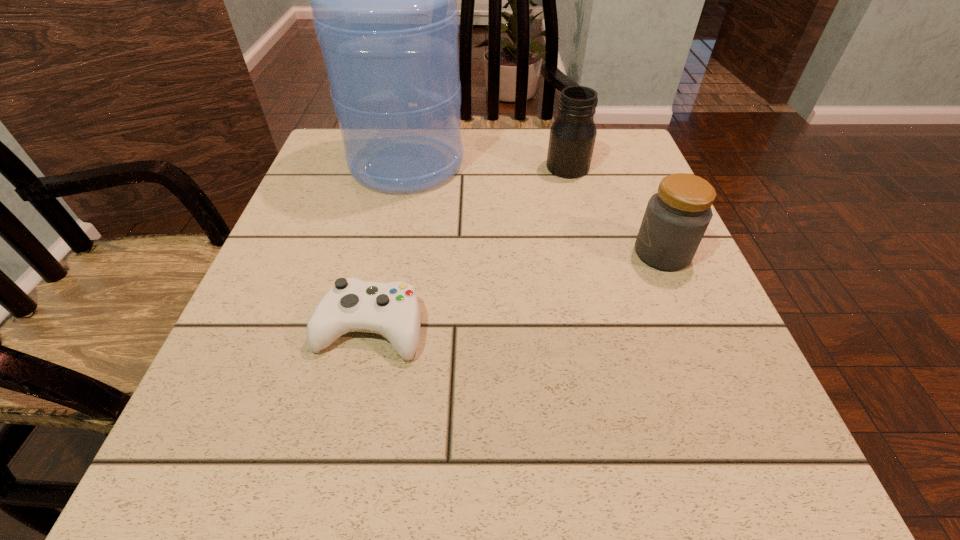
Identify the location of the tallest object. The height and width of the screenshot is (540, 960). (384, 7).

At what (x,y) coordinates should I click in order to perform the action: click on the third object from left to right. Please return your answer as a coordinate pair (x, y). Looking at the image, I should click on (572, 137).

Where is `the left jar`? Image resolution: width=960 pixels, height=540 pixels. the left jar is located at coordinates (572, 137).

Where is `the second shortest object`? the second shortest object is located at coordinates (676, 218).

Image resolution: width=960 pixels, height=540 pixels. I want to click on the nearer jar, so click(x=676, y=218).

Locate an element on the screen. Image resolution: width=960 pixels, height=540 pixels. the nearest object is located at coordinates (392, 310).

Find the location of a particular element. control is located at coordinates (392, 310).

The width and height of the screenshot is (960, 540). In order to click on vacant position located on the left of the farther jar in this screenshot , I will do `click(512, 167)`.

I want to click on free space located 0.300m on the surface of the rightmost object near the warning symbol, so click(x=474, y=253).

You are a GUI agent. You are given a task and a screenshot of the screen. Output one action in this format:
    pyautogui.click(x=<x>, y=<y>)
    Task: Click on the free region located 0.130m on the surface of the rightmost object near the warning symbol
    
    Given the screenshot: What is the action you would take?
    pyautogui.click(x=564, y=253)